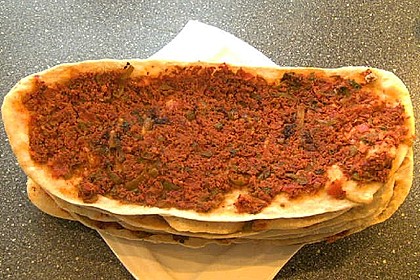
Locate an element on the screen. dish is located at coordinates (148, 257).